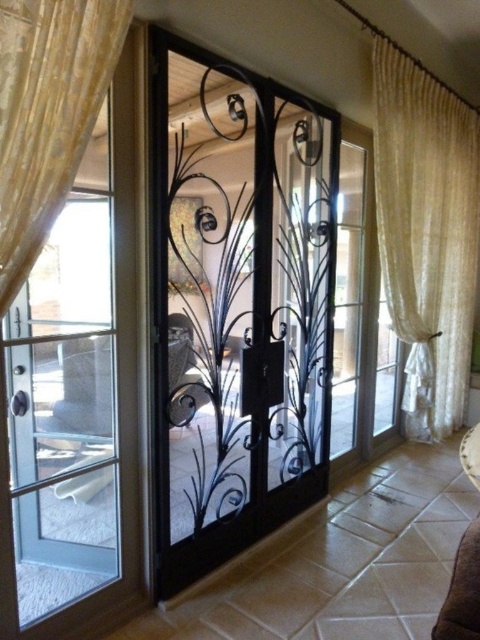
Consider the image. Who is more distant from viewer, (228, 413) or (99, 70)?

Positioned behind is point (228, 413).

Can you confirm if black wrought iron screen door at center is smaller than gold textured curtain at upper left?

Actually, black wrought iron screen door at center might be larger than gold textured curtain at upper left.

Locate an element on the screen. This screenshot has width=480, height=640. black wrought iron screen door at center is located at coordinates (238, 305).

Is sheer white curtain at right closer to the viewer compared to gold textured curtain at upper left?

No, sheer white curtain at right is behind gold textured curtain at upper left.

Which of these two, sheer white curtain at right or gold textured curtain at upper left, stands taller?

sheer white curtain at right

This screenshot has width=480, height=640. In order to click on sheer white curtain at right in this screenshot , I will do coord(427,234).

Between point (328, 422) and point (446, 384), which one is positioned behind?

The point (446, 384) is behind.

Can you confirm if black wrought iron screen door at center is positioned below sheer white curtain at right?

Correct, black wrought iron screen door at center is located below sheer white curtain at right.

Does point (210, 291) come closer to viewer compared to point (456, 416)?

Yes, point (210, 291) is in front of point (456, 416).

The width and height of the screenshot is (480, 640). Identify the location of black wrought iron screen door at center. (238, 305).